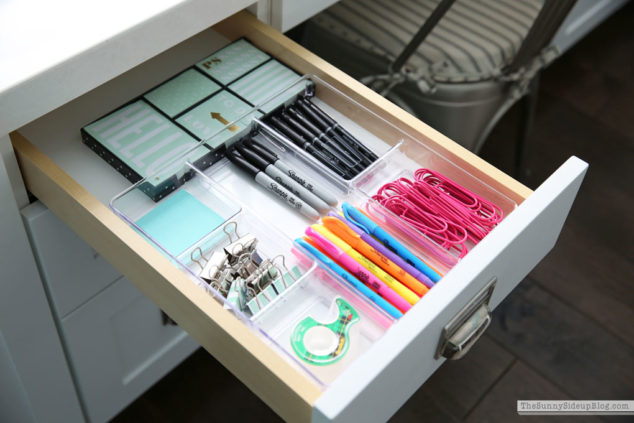
Where is `pens`? The image size is (634, 423). pens is located at coordinates (283, 125), (292, 125), (304, 121), (317, 118), (327, 118).